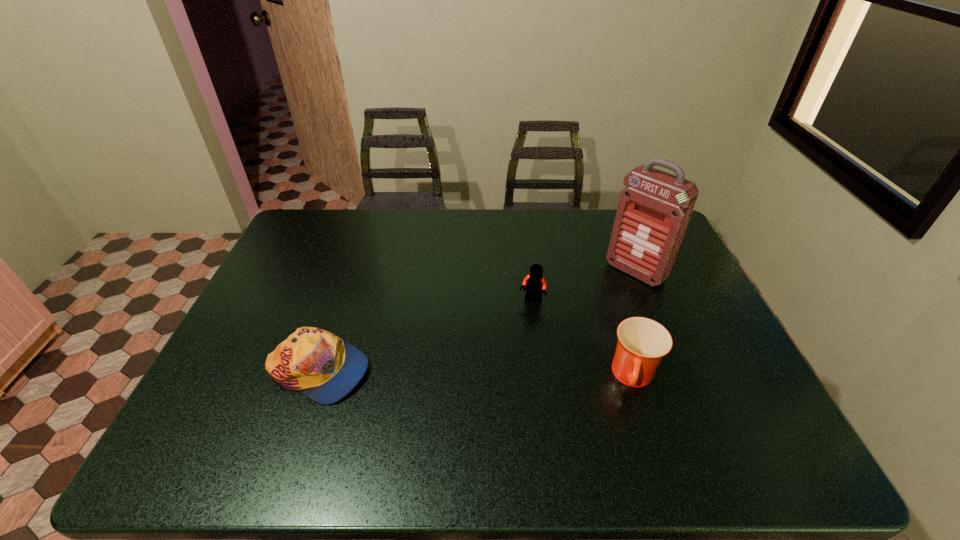
This screenshot has height=540, width=960. In order to click on vacant area situated 0.270m on the front-facing side of the Lego in this screenshot , I will do `click(492, 379)`.

Locate an element on the screen. free space located 0.260m on the front-facing side of the Lego is located at coordinates (492, 376).

Locate an element on the screen. The image size is (960, 540). vacant space located 0.400m on the front-facing side of the farthest object is located at coordinates (538, 359).

Find the location of a particular element. The width and height of the screenshot is (960, 540). free space located 0.270m on the front-facing side of the farthest object is located at coordinates (567, 332).

Where is `vacant position located 0.200m on the front-facing side of the farthest object`? vacant position located 0.200m on the front-facing side of the farthest object is located at coordinates (583, 319).

Locate an element on the screen. cap that is at the near edge is located at coordinates [325, 368].

Find the location of a particular element. This screenshot has width=960, height=540. cup that is at the near edge is located at coordinates (642, 342).

You are a GUI agent. You are given a task and a screenshot of the screen. Output one action in this format:
    pyautogui.click(x=<x>, y=<y>)
    Task: Click on the object present at the left edge
    This screenshot has height=540, width=960.
    Given the screenshot: What is the action you would take?
    [x=325, y=368]

The image size is (960, 540). Find the location of `object present at the right edge`. object present at the right edge is located at coordinates (653, 212).

Where is `object at the near left corner`? The width and height of the screenshot is (960, 540). object at the near left corner is located at coordinates (325, 368).